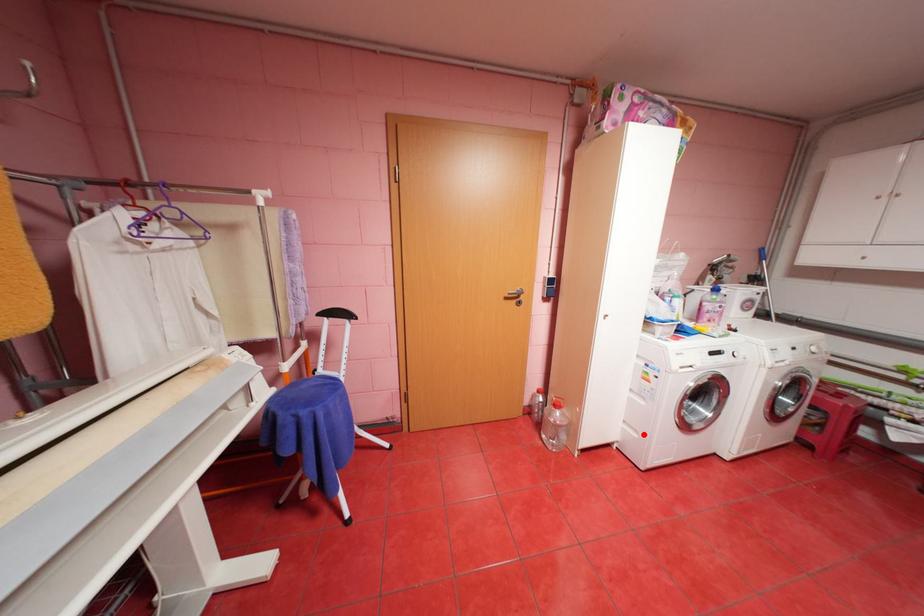
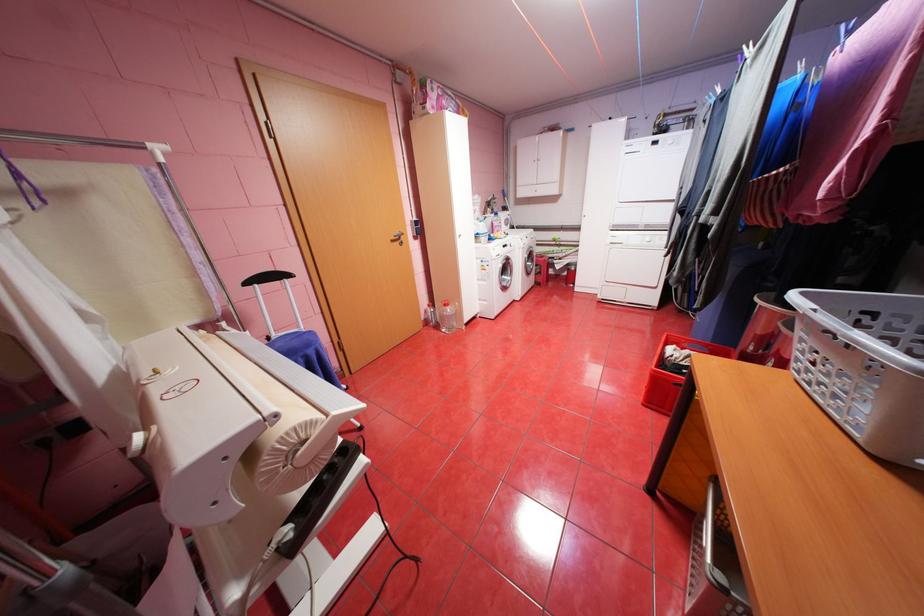
The point at the highlighted location is marked in the first image. Where is the corresponding point in the second image?

(494, 302)